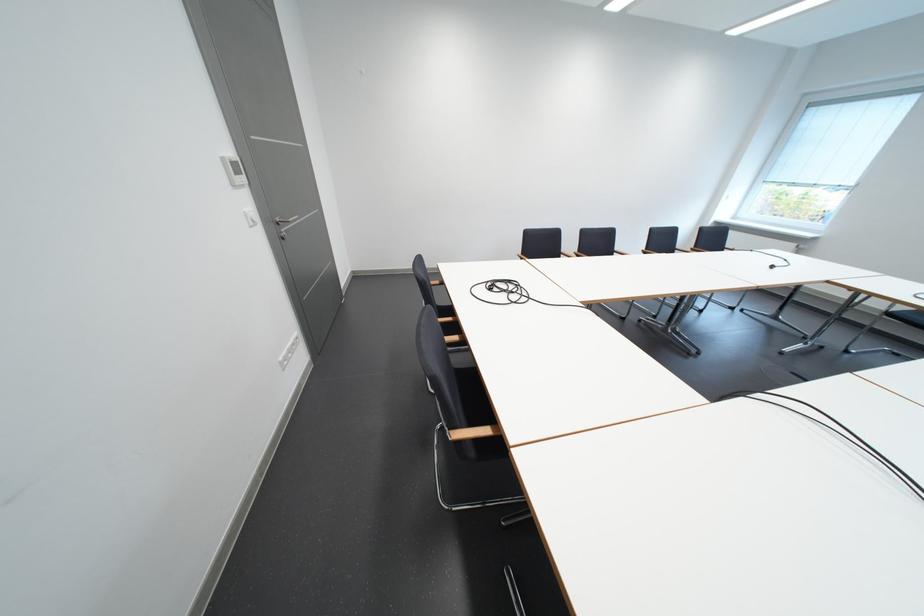
The width and height of the screenshot is (924, 616). What do you see at coordinates (472, 432) in the screenshot?
I see `a wooden chair armrest` at bounding box center [472, 432].